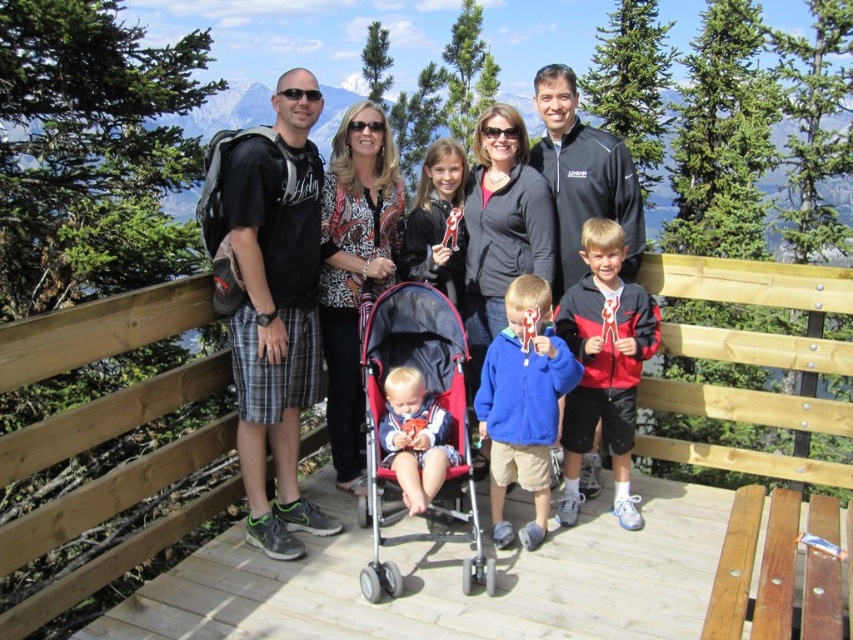
Is wooden at center to the right of wooden bench at lower center from the viewer's perspective?

Incorrect, wooden at center is not on the right side of wooden bench at lower center.

At what (x,y) coordinates should I click in order to perform the action: click on wooden at center. Please return your answer as a coordinate pair (x, y). This screenshot has width=853, height=640. Looking at the image, I should click on (753, 362).

Can you confirm if wooden at center is positioned to the right of matte black stroller at center?

Yes, wooden at center is to the right of matte black stroller at center.

Can you confirm if wooden at center is positioned to the left of matte black stroller at center?

In fact, wooden at center is to the right of matte black stroller at center.

The height and width of the screenshot is (640, 853). Identify the location of wooden at center. (753, 362).

Is wooden at center bigger than red matte jacket at center?

Indeed, wooden at center has a larger size compared to red matte jacket at center.

Is wooden at center smaller than red matte jacket at center?

Incorrect, wooden at center is not smaller in size than red matte jacket at center.

Between point (828, 595) and point (618, 276), which one is positioned in front?

Point (828, 595) is more forward.

I want to click on wooden at center, so click(753, 362).